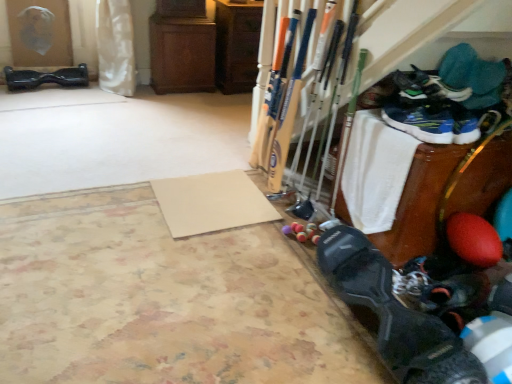
Question: From the image's perspective, is blue mesh sneakers at lower right, the third footwear when ordered from back to front, over blue synthetic shoe at upper right, placed as the sixth footwear when sorted from left to right?

Choices:
 (A) no
 (B) yes

Answer: (A)

Question: Is blue mesh sneakers at lower right, which is the 3th footwear in bottom-to-top order, facing towards blue synthetic shoe at upper right, the 5th footwear ordered from the bottom?

Choices:
 (A) yes
 (B) no

Answer: (B)

Question: Considering the relative sizes of blue mesh sneakers at lower right, which ranks as the fourth footwear in front-to-back order, and blue synthetic shoe at upper right, the fifth footwear when ordered from front to back, in the image provided, is blue mesh sneakers at lower right, which ranks as the fourth footwear in front-to-back order, taller than blue synthetic shoe at upper right, the fifth footwear when ordered from front to back,?

Choices:
 (A) no
 (B) yes

Answer: (A)

Question: Would you say blue synthetic shoe at upper right, placed as the sixth footwear when sorted from left to right, is part of blue mesh sneakers at lower right, which is the 3th footwear in bottom-to-top order,'s contents?

Choices:
 (A) no
 (B) yes

Answer: (A)

Question: Does blue mesh sneakers at lower right, the 4th footwear from the top, have a larger size compared to blue synthetic shoe at upper right, the fifth footwear when ordered from front to back?

Choices:
 (A) no
 (B) yes

Answer: (A)

Question: Is blue synthetic shoe at upper right, placed as the sixth footwear when sorted from left to right, bigger or smaller than beige matte yoga mat at center, which is the second yoga mat from front to back?

Choices:
 (A) big
 (B) small

Answer: (A)

Question: Considering the positions of blue synthetic shoe at upper right, the fifth footwear when ordered from front to back, and beige matte yoga mat at center, which is counted as the 1th yoga mat, starting from the back, in the image, is blue synthetic shoe at upper right, the fifth footwear when ordered from front to back, taller or shorter than beige matte yoga mat at center, which is counted as the 1th yoga mat, starting from the back,?

Choices:
 (A) short
 (B) tall

Answer: (B)

Question: In terms of width, does blue synthetic shoe at upper right, the fifth footwear when ordered from front to back, look wider or thinner when compared to beige matte yoga mat at center, which is the second yoga mat from front to back?

Choices:
 (A) wide
 (B) thin

Answer: (B)

Question: Is blue synthetic shoe at upper right, the fifth footwear when ordered from front to back, in front of or behind beige matte yoga mat at center, which is counted as the 1th yoga mat, starting from the back, in the image?

Choices:
 (A) behind
 (B) front

Answer: (B)

Question: From a real-world perspective, is black matte shoe at lower right, positioned as the 1th footwear in bottom-to-top order, positioned above or below blue mesh sneakers at lower right, which ranks as the 3th footwear in right-to-left order?

Choices:
 (A) below
 (B) above

Answer: (A)

Question: In terms of width, does black matte shoe at lower right, positioned as the 1th footwear in bottom-to-top order, look wider or thinner when compared to blue mesh sneakers at lower right, which ranks as the 3th footwear in right-to-left order?

Choices:
 (A) wide
 (B) thin

Answer: (A)

Question: Choose the correct answer: Is black matte shoe at lower right, the first footwear in the front-to-back sequence, inside blue mesh sneakers at lower right, which is the 4th footwear in left-to-right order, or outside it?

Choices:
 (A) inside
 (B) outside

Answer: (B)

Question: Visually, is black matte shoe at lower right, positioned as the 1th footwear in bottom-to-top order, positioned to the left or to the right of blue mesh sneakers at lower right, which is the 3th footwear in bottom-to-top order?

Choices:
 (A) left
 (B) right

Answer: (A)

Question: Is point (197, 182) positioned closer to the camera than point (475, 59)?

Choices:
 (A) closer
 (B) farther

Answer: (B)

Question: Is beige matte yoga mat at center, which is the second yoga mat from front to back, in front of or behind blue synthetic shoe at upper right, the 5th footwear ordered from the bottom, in the image?

Choices:
 (A) front
 (B) behind

Answer: (B)